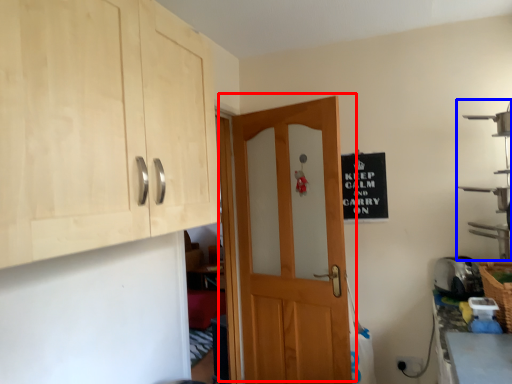
Question: Which object is closer to the camera taking this photo, door (highlighted by a red box) or shelf (highlighted by a blue box)?

Choices:
 (A) door
 (B) shelf

Answer: (B)